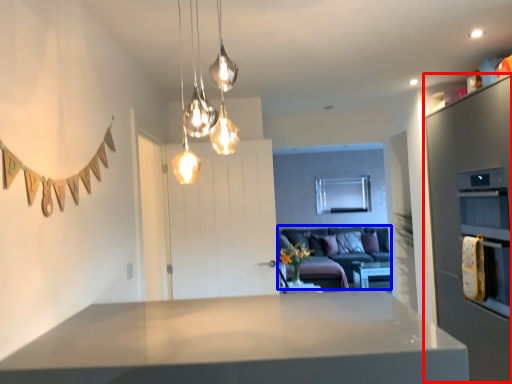
Question: Which object appears closest to the camera in this image, cabinetry (highlighted by a red box) or couch (highlighted by a blue box)?

Choices:
 (A) cabinetry
 (B) couch

Answer: (A)